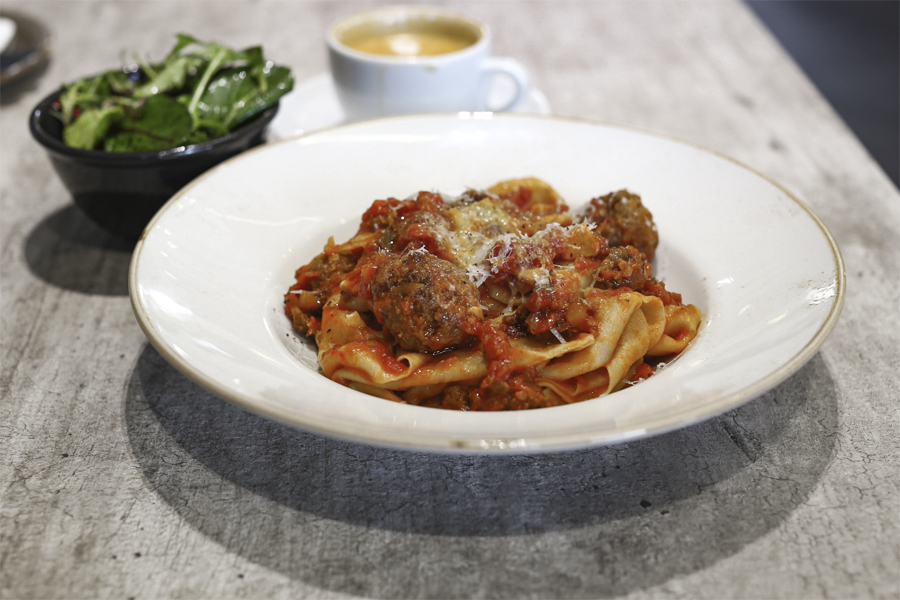
Where is `coffee cup`? The width and height of the screenshot is (900, 600). coffee cup is located at coordinates (363, 62).